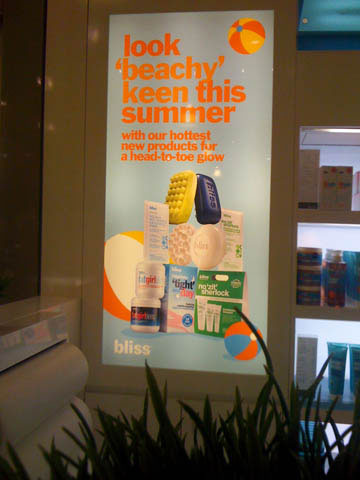
Identify the location of scrubber. This screenshot has height=480, width=360. (185, 236), (179, 187).